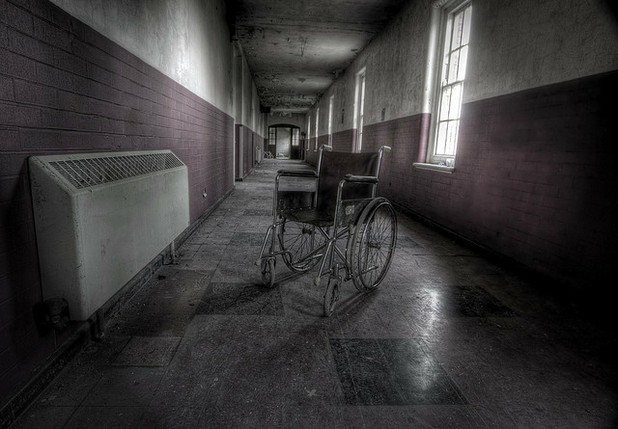
The height and width of the screenshot is (429, 618). In order to click on brick walls in this screenshot , I will do `click(549, 160)`, `click(62, 88)`.